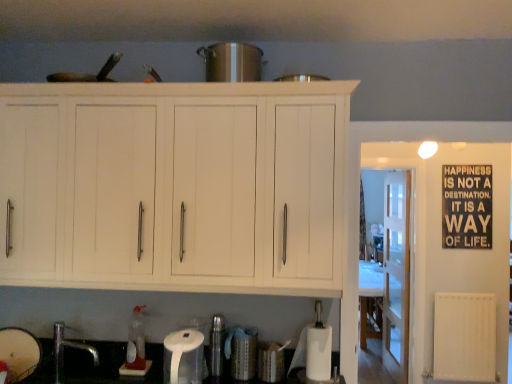
Question: Is metallic silver canister at lower center, the 4th appliance in the top-to-bottom sequence, placed right next to matte white bowl at lower left, the third appliance in the top-to-bottom sequence?

Choices:
 (A) yes
 (B) no

Answer: (B)

Question: Is metallic silver canister at lower center, which is the 1th appliance in right-to-left order, wider than matte white bowl at lower left, the fourth appliance from the right?

Choices:
 (A) yes
 (B) no

Answer: (A)

Question: Could you tell me if metallic silver canister at lower center, positioned as the 1th appliance in bottom-to-top order, is facing matte white bowl at lower left, the second appliance from the bottom?

Choices:
 (A) no
 (B) yes

Answer: (A)

Question: From a real-world perspective, is metallic silver canister at lower center, the 4th appliance in the top-to-bottom sequence, physically above matte white bowl at lower left, which is the 1th appliance from left to right?

Choices:
 (A) yes
 (B) no

Answer: (B)

Question: Can you confirm if metallic silver canister at lower center, which is the 1th appliance in right-to-left order, is bigger than matte white bowl at lower left, the fourth appliance from the right?

Choices:
 (A) yes
 (B) no

Answer: (B)

Question: Considering the relative sizes of metallic silver canister at lower center, which is the 1th appliance in right-to-left order, and matte white bowl at lower left, the third appliance in the top-to-bottom sequence, in the image provided, is metallic silver canister at lower center, which is the 1th appliance in right-to-left order, taller than matte white bowl at lower left, the third appliance in the top-to-bottom sequence,?

Choices:
 (A) no
 (B) yes

Answer: (A)

Question: From the image's perspective, is white wood cabinet at upper center located above white plastic radiator at right?

Choices:
 (A) no
 (B) yes

Answer: (B)

Question: From the image's perspective, is white wood cabinet at upper center located beneath white plastic radiator at right?

Choices:
 (A) no
 (B) yes

Answer: (A)

Question: Is white wood cabinet at upper center bigger than white plastic radiator at right?

Choices:
 (A) yes
 (B) no

Answer: (A)

Question: Is white wood cabinet at upper center far from white plastic radiator at right?

Choices:
 (A) yes
 (B) no

Answer: (A)

Question: Is white wood cabinet at upper center not inside white plastic radiator at right?

Choices:
 (A) yes
 (B) no

Answer: (A)

Question: Is white wood cabinet at upper center taller than white plastic radiator at right?

Choices:
 (A) yes
 (B) no

Answer: (A)

Question: Considering the relative positions of shiny metallic pot at center, marked as the 2th appliance in a right-to-left arrangement, and black matte signboard at upper right in the image provided, is shiny metallic pot at center, marked as the 2th appliance in a right-to-left arrangement, behind black matte signboard at upper right?

Choices:
 (A) yes
 (B) no

Answer: (B)